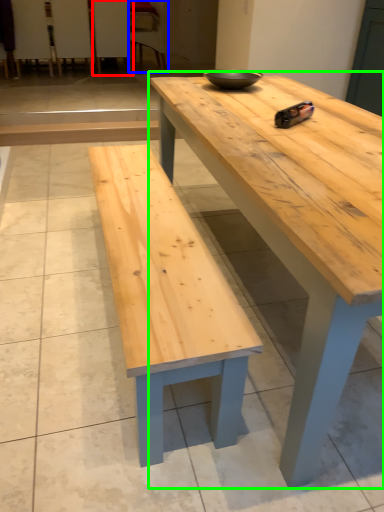
Question: Which is farther away from chair (highlighted by a red box)? chair (highlighted by a blue box) or coffee table (highlighted by a green box)?

Choices:
 (A) chair
 (B) coffee table

Answer: (B)